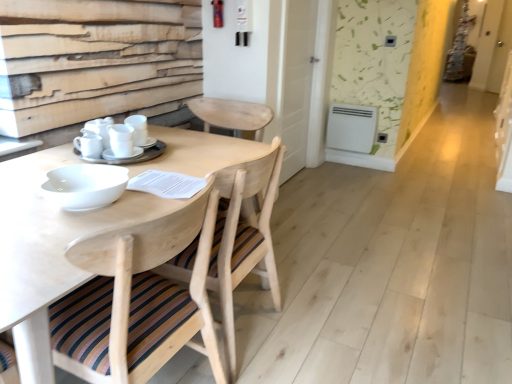
The image size is (512, 384). Identify the location of free location above natural wood round table at center (from a real-world perspective). (129, 171).